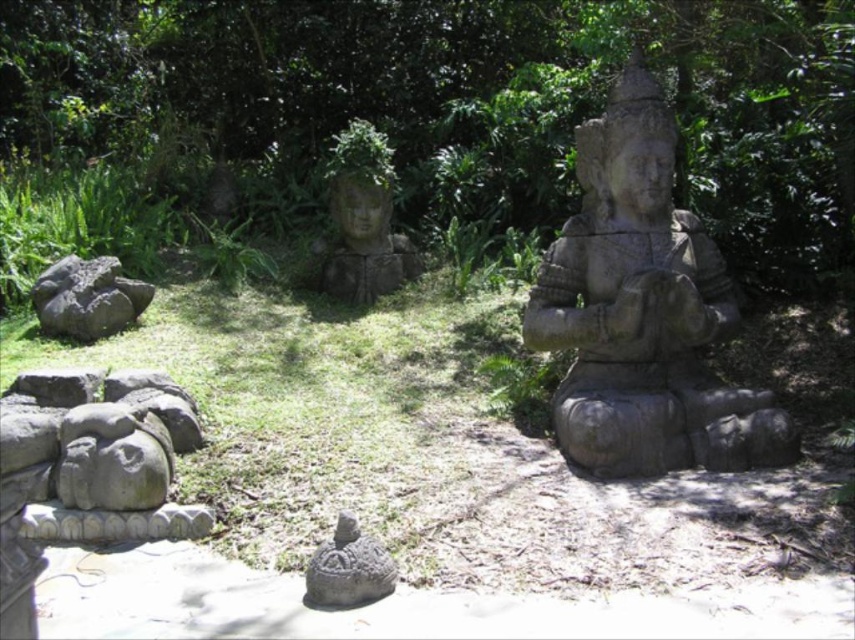
Does gray stone statue at center appear on the left side of gray rough rock at lower left?

In fact, gray stone statue at center is to the right of gray rough rock at lower left.

Locate an element on the screen. The width and height of the screenshot is (855, 640). gray stone statue at center is located at coordinates (643, 310).

Identify the location of gray stone statue at center. The image size is (855, 640). (643, 310).

Is green mossy stone head at center below gray stone turtle at center?

Actually, green mossy stone head at center is above gray stone turtle at center.

How distant is green mossy stone head at center from gray stone turtle at center?

2.86 meters

Find the location of a particular element. Image resolution: width=855 pixels, height=640 pixels. green mossy stone head at center is located at coordinates (363, 220).

Does gray stone head at lower left appear under gray stone turtle at center?

No.

Does point (140, 376) come behind point (357, 600)?

Yes, it is behind point (357, 600).

Find the location of a particular element. The height and width of the screenshot is (640, 855). gray stone head at lower left is located at coordinates (99, 454).